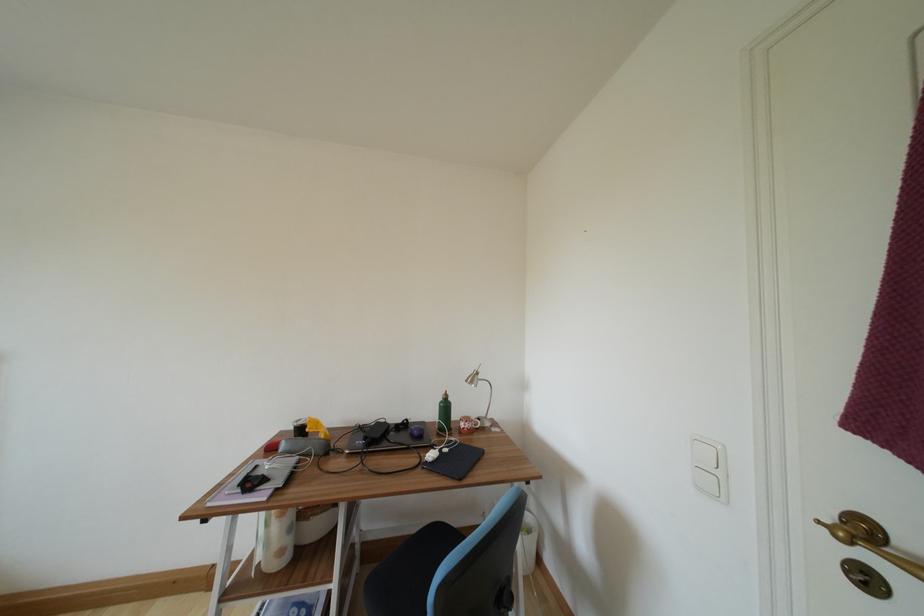
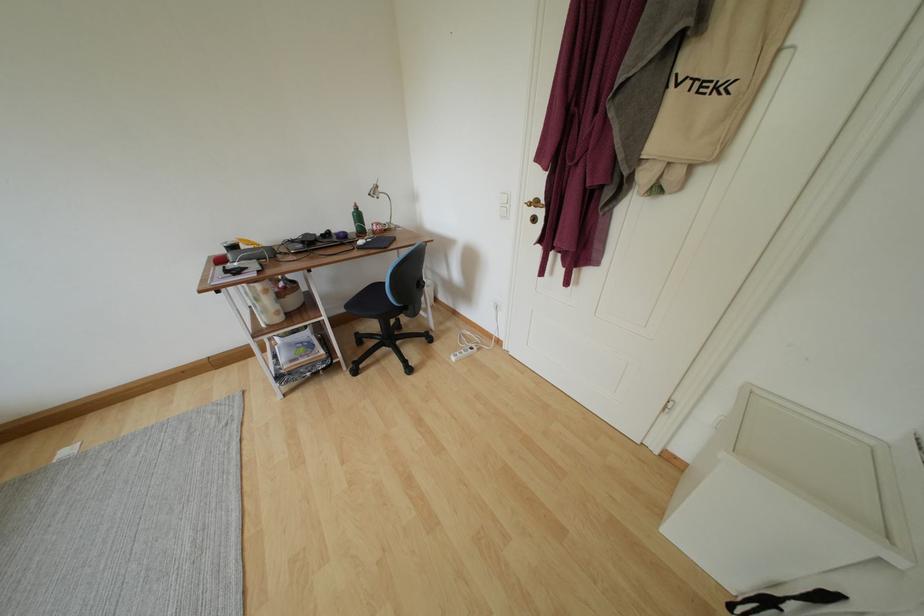
Find the pixel in the second image that matches pixel 869 533 in the first image.

(541, 207)